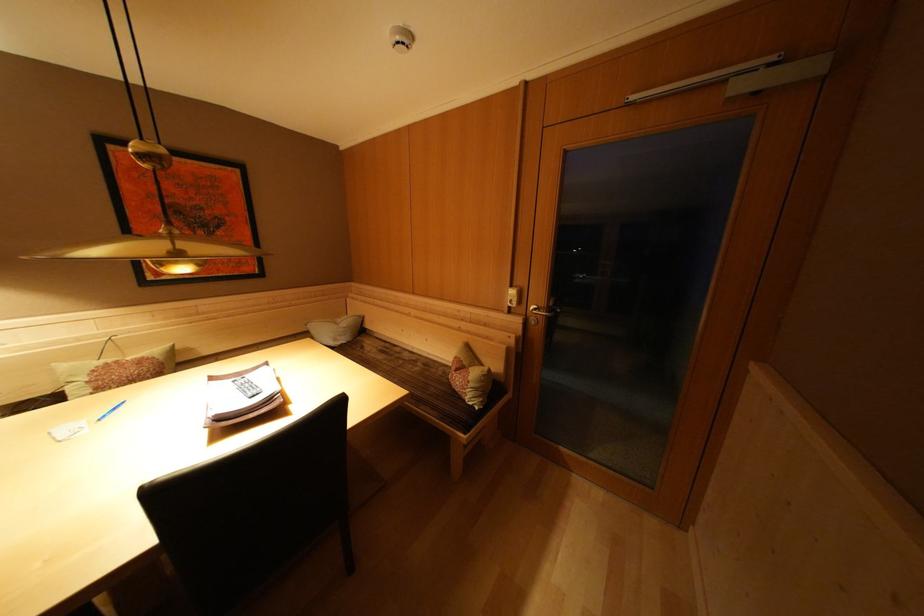
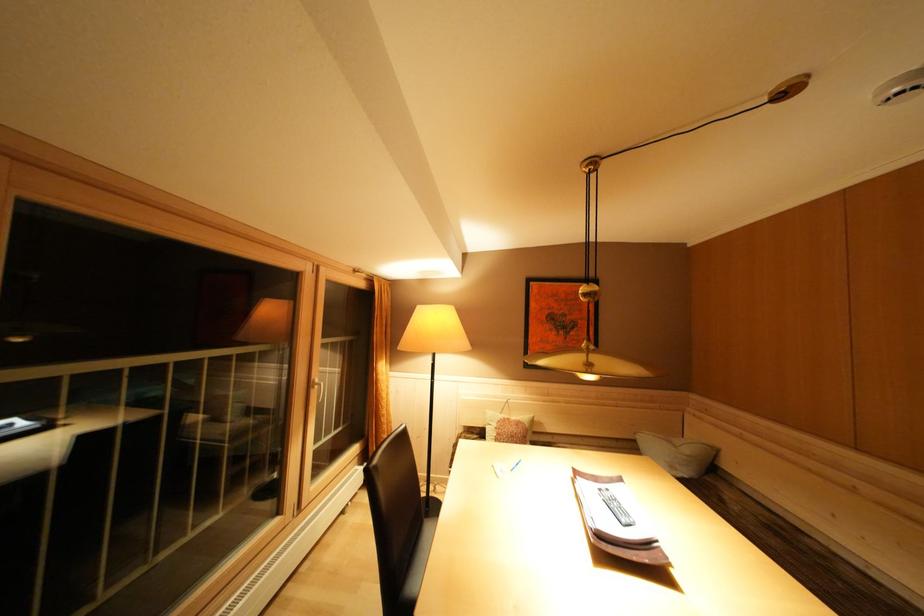
Where in the second image is the point corresponding to (124,367) from the first image?

(515, 424)